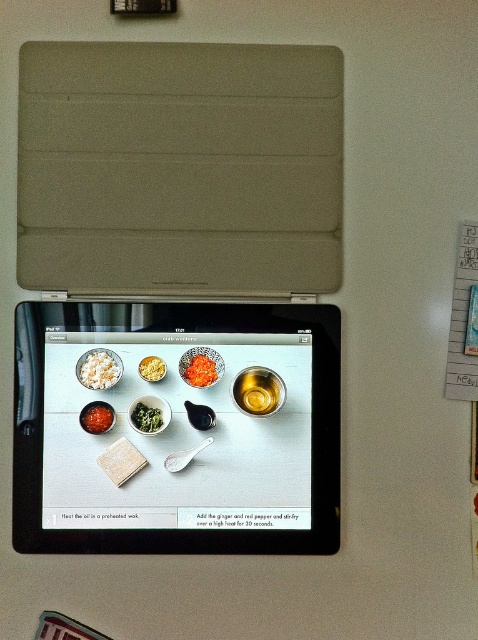
What do you see at coordinates (178, 429) in the screenshot? I see `black glossy tablet at center` at bounding box center [178, 429].

Can you confirm if black glossy tablet at center is shorter than bright red paste at center?

Incorrect, black glossy tablet at center's height does not fall short of bright red paste at center's.

What do you see at coordinates (178, 429) in the screenshot? I see `black glossy tablet at center` at bounding box center [178, 429].

Where is `black glossy tablet at center`? Image resolution: width=478 pixels, height=640 pixels. black glossy tablet at center is located at coordinates (178, 429).

Between point (116, 58) and point (97, 371), which one is positioned in front?

Point (116, 58) is in front.

Find the location of a particular element. This screenshot has height=640, width=478. black plastic tablet at center is located at coordinates (178, 296).

Measure the distance between point [101,96] and camera.

Point [101,96] and camera are 1.11 meters apart.

At what (x,y) coordinates should I click in order to perform the action: click on black plastic tablet at center. Please return your answer as a coordinate pair (x, y). This screenshot has width=478, height=640. Looking at the image, I should click on (178, 296).

Who is more forward, (107, 371) or (153, 362)?

Point (107, 371) is more forward.

Does white fluffy rice at upper left have a greater height compared to yellow crumbly at center?

Correct, white fluffy rice at upper left is much taller as yellow crumbly at center.

The image size is (478, 640). I want to click on white fluffy rice at upper left, so click(x=98, y=369).

Locate an element on the screen. This screenshot has width=478, height=640. white fluffy rice at upper left is located at coordinates (98, 369).